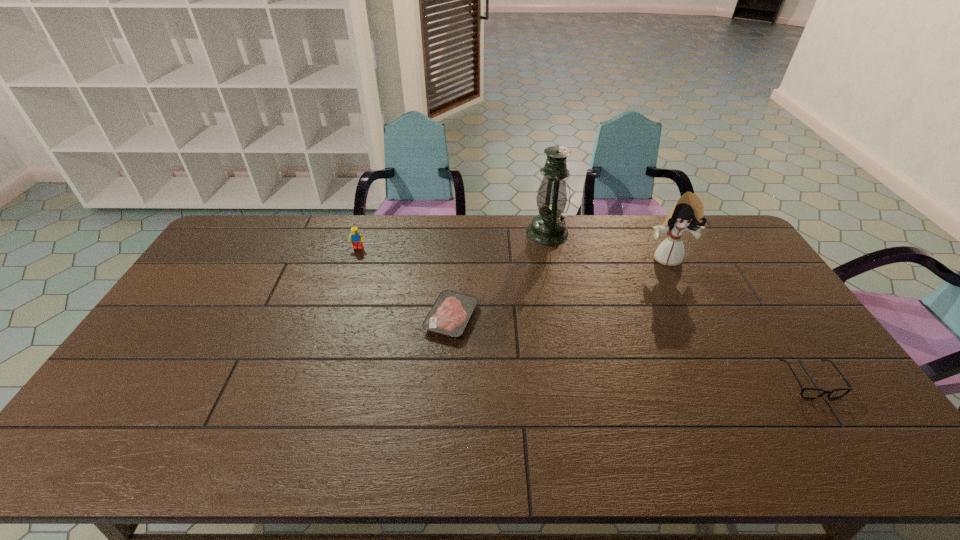
Identify the location of blank area located 0.400m on the front of the third object from left to right. (566, 330).

The image size is (960, 540). I want to click on vacant region located at the front face of the fourth shortest object, so click(x=682, y=288).

Find the location of a particular element. The width and height of the screenshot is (960, 540). free spot located 0.360m on the front-facing side of the leftmost object is located at coordinates (332, 326).

Find the location of a particular element. The height and width of the screenshot is (540, 960). free location located on the front-facing side of the rightmost object is located at coordinates (839, 426).

Find the location of a particular element. This screenshot has width=960, height=540. free region located 0.260m on the left of the steak is located at coordinates (339, 318).

Locate an element on the screen. The height and width of the screenshot is (540, 960). oil lamp that is positioned at the far edge is located at coordinates (548, 228).

Locate an element on the screen. The height and width of the screenshot is (540, 960). doll that is at the far edge is located at coordinates (687, 214).

Find the location of a particular element. The width and height of the screenshot is (960, 540). Lego that is at the far edge is located at coordinates (356, 238).

At what (x,y) coordinates should I click in order to perform the action: click on object at the right edge. Please return your answer as a coordinate pair (x, y). This screenshot has width=960, height=540. Looking at the image, I should click on (810, 393).

The width and height of the screenshot is (960, 540). In the image, there is a desktop. Find the location of `vacant region at the far edge`. vacant region at the far edge is located at coordinates pyautogui.click(x=688, y=242).